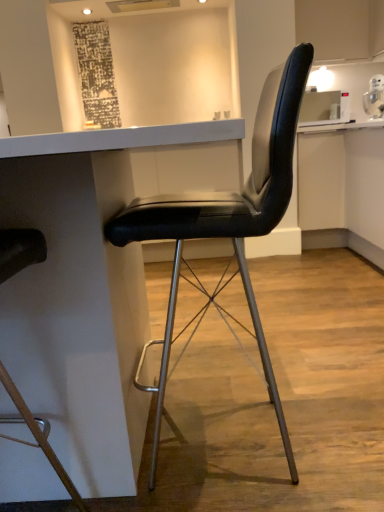
Where is `vacant space behind black leather chair at center, the 1th chair when ordered from right to left`? vacant space behind black leather chair at center, the 1th chair when ordered from right to left is located at coordinates (269, 360).